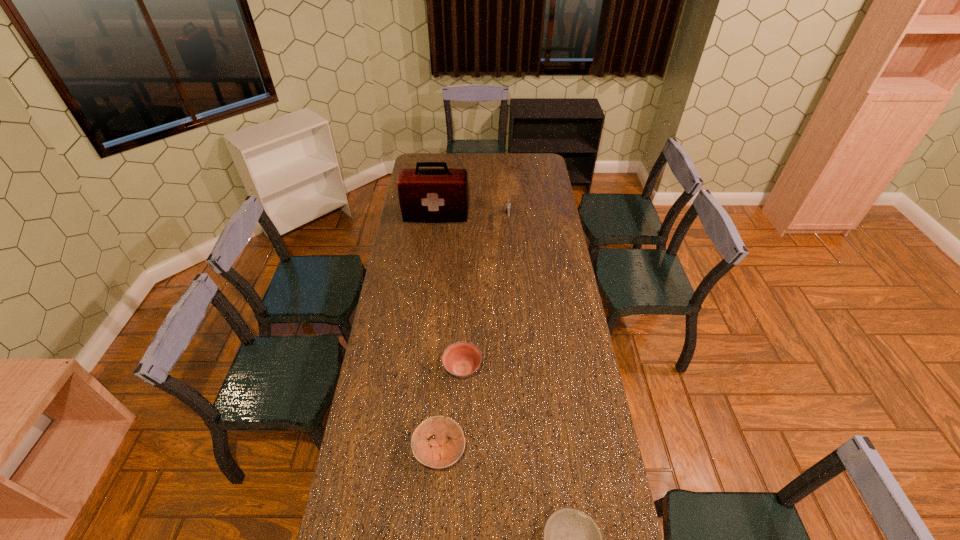
At what (x,y) coordinates should I click in order to perform the action: click on object that is the third closest to the fourth farthest object. Please return your answer as a coordinate pair (x, y). Image resolution: width=960 pixels, height=540 pixels. Looking at the image, I should click on (508, 206).

Identify the location of object identified as the closest to the second tallest object. (434, 195).

Identify which bowl is located as the nearest to the fourth shortest object. Please provide its 2D coordinates. Your answer should be formatted as a tuple, i.e. [(x, y)], where the tuple contains the x and y coordinates of a point satisfying the conditions above.

[(461, 359)]

I want to click on the closest bowl relative to the farthest bowl, so click(443, 453).